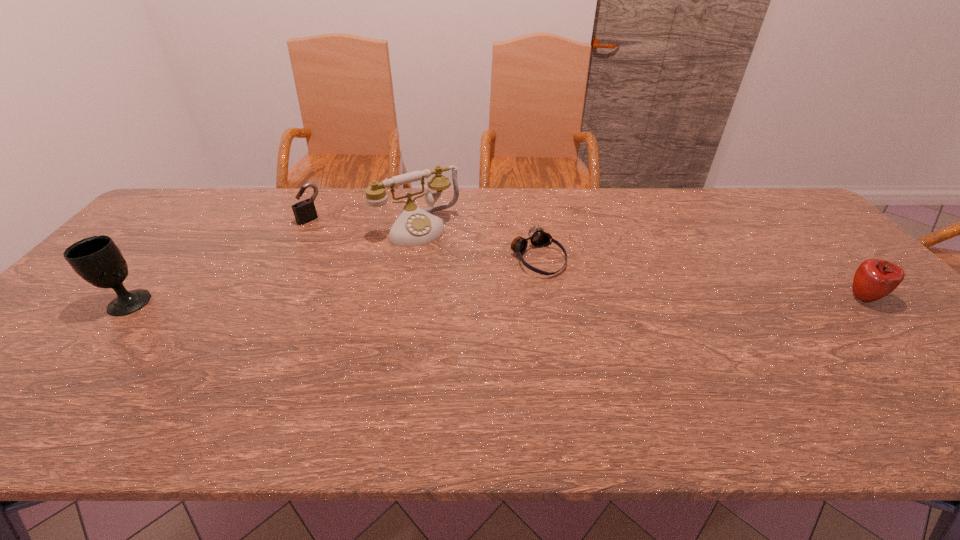
Find the location of `object positioned at the right edge`. object positioned at the right edge is located at coordinates (874, 279).

What are the coordinates of `vacant space at the far edge` in the screenshot? It's located at coord(228,193).

This screenshot has width=960, height=540. Identify the location of vacant space at the near edge of the desktop. (630, 361).

At what (x,y) coordinates should I click in order to perform the action: click on free region at the far left corner of the desktop. Please return your answer as a coordinate pair (x, y). This screenshot has width=960, height=540. Looking at the image, I should click on (179, 200).

You are a GUI agent. You are given a task and a screenshot of the screen. Output one action in this format:
    pyautogui.click(x=<x>, y=<y>)
    Task: Click on the free spot at the far right corner of the desktop
    The image size is (960, 540).
    Given the screenshot: What is the action you would take?
    pyautogui.click(x=787, y=214)

Locate an element on the screen. The height and width of the screenshot is (540, 960). free space that is in between the chalice and the shortest object is located at coordinates (333, 280).

The image size is (960, 540). Find the location of `unoccupied position between the leftmost object and the rightmost object`. unoccupied position between the leftmost object and the rightmost object is located at coordinates (495, 300).

You are a GUI agent. You are given a task and a screenshot of the screen. Output one action in this format:
    pyautogui.click(x=<x>, y=<y>)
    Task: Click on the free space between the chalice and the apple
    The image size is (960, 540).
    Given the screenshot: What is the action you would take?
    pyautogui.click(x=495, y=300)

You are a GUI agent. You are given a task and a screenshot of the screen. Output one action in this format:
    pyautogui.click(x=<x>, y=<y>)
    Task: Click on the free spot between the leftmost object and the fourth object from right to left
    The width and height of the screenshot is (960, 540).
    Given the screenshot: What is the action you would take?
    pyautogui.click(x=219, y=261)

This screenshot has width=960, height=540. Find the location of `free spot between the rightmost object and the leftmost object`. free spot between the rightmost object and the leftmost object is located at coordinates (495, 300).